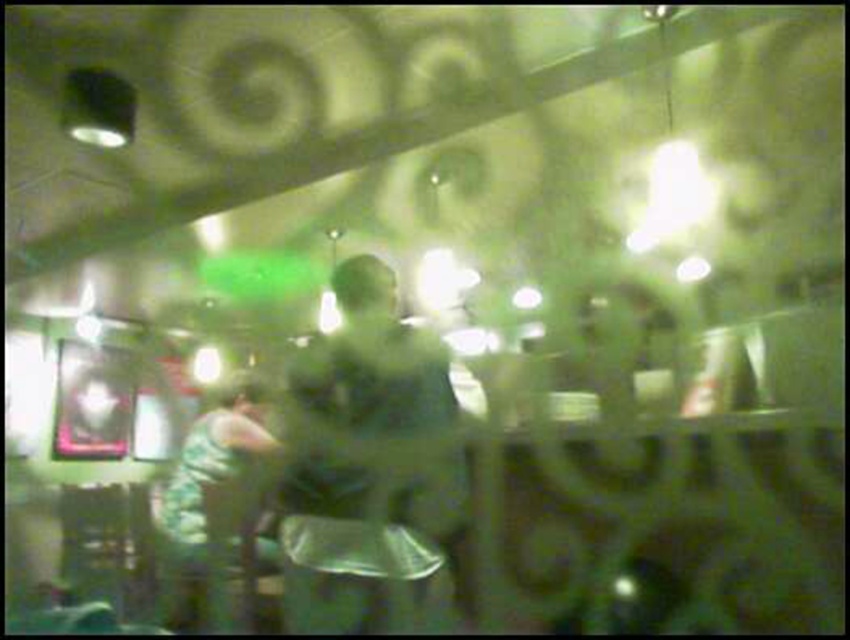
You are standing in the bar and want to take a photo of both point (x=364, y=428) and point (x=248, y=467). Which point should you focus on first to ensure both are in focus?

You should focus on point (x=364, y=428) first because it is closer to the camera than point (x=248, y=467). This way, the depth of field will likely cover both points when focusing on the closer one.

You are a customer at the bar and want to order a drink. Which server should you approach first, the one wearing the green matte shirt at center or the one in the green camouflage jacket at left, based on their height?

The green matte shirt at center is taller than the green camouflage jacket at left, so you should approach the server wearing the green matte shirt at center first as they are taller and likely more visible.

You are a customer at the bar and want to ask the bartender wearing the green matte shirt at center for a drink. However, there is a person in the green camouflage jacket at left blocking your view. Can you still see the bartender?

The green matte shirt at center is positioned on the right side of the green camouflage jacket at left, so the bartender is to the right of the blocking individual. Since you are standing in front of the bar, you should still be able to see the bartender around the person in the green camouflage jacket at left.